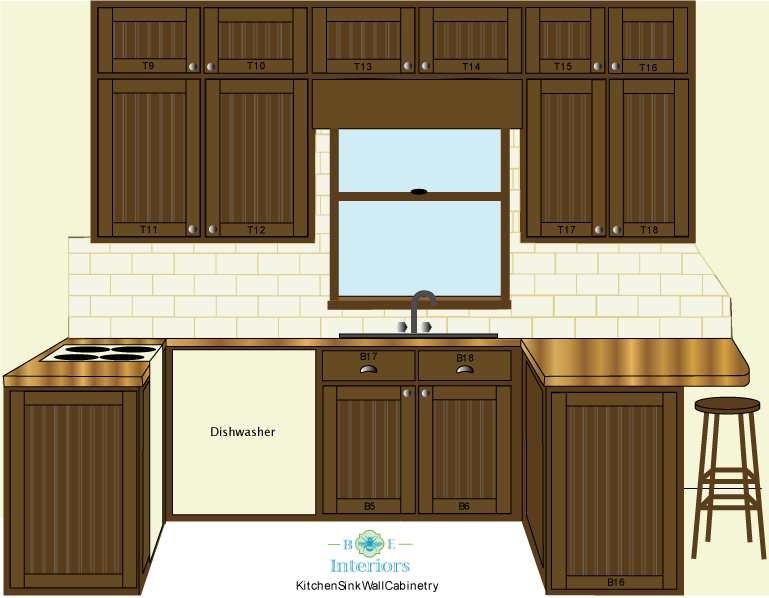
The width and height of the screenshot is (769, 598). In order to click on chair in this screenshot , I will do point(730,410).